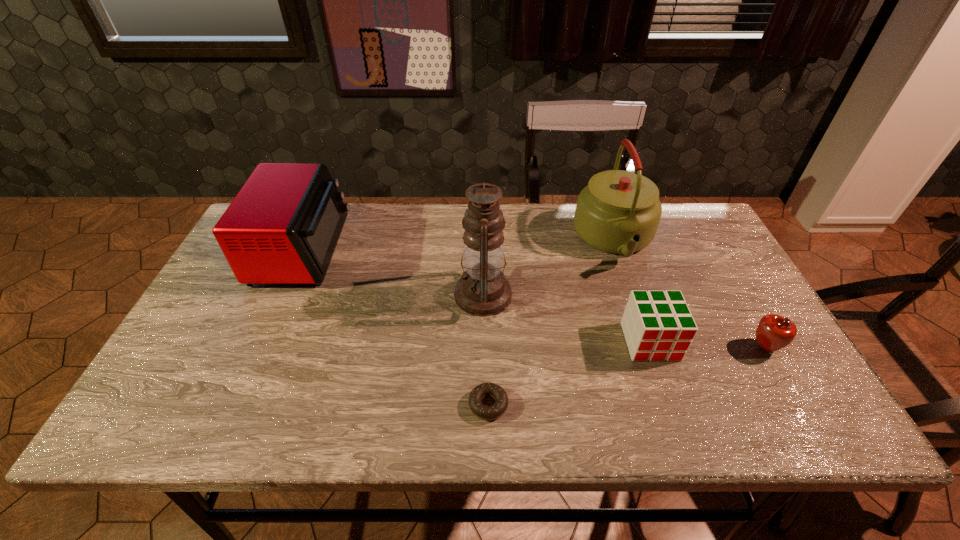
You are a GUI agent. You are given a task and a screenshot of the screen. Output one action in this format:
    pyautogui.click(x=<x>, y=<y>)
    Task: Click on the oil lamp
    
    Given the screenshot: What is the action you would take?
    pyautogui.click(x=483, y=290)

Identify the location of the second tallest object. (619, 211).

The width and height of the screenshot is (960, 540). In order to click on the leftmost object in this screenshot , I will do 283,226.

Identify the location of toaster oven. (283, 226).

Identify the location of cube. (657, 325).

Where is `the fifth tallest object`? The width and height of the screenshot is (960, 540). the fifth tallest object is located at coordinates (773, 332).

Locate an element on the screen. Image resolution: width=960 pixels, height=540 pixels. apple is located at coordinates (773, 332).

Image resolution: width=960 pixels, height=540 pixels. In order to click on the nearest object in this screenshot , I will do `click(484, 412)`.

Identify the location of doughnut. (484, 412).

This screenshot has width=960, height=540. In order to click on free region located 0.140m on the left of the tallest object in this screenshot , I will do `click(402, 294)`.